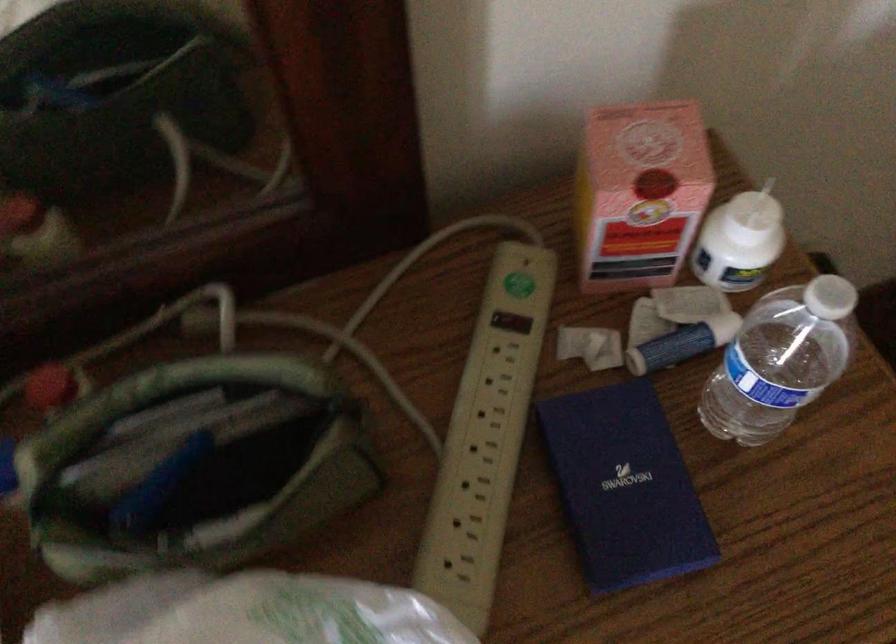
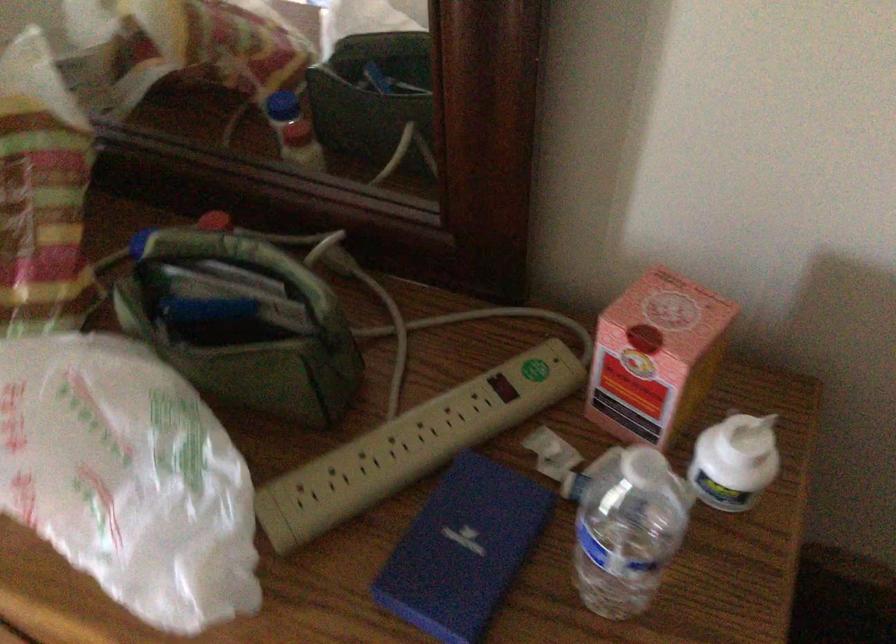
Locate, in the second image, the point that corresponds to point (763, 212) in the first image.

(754, 435)